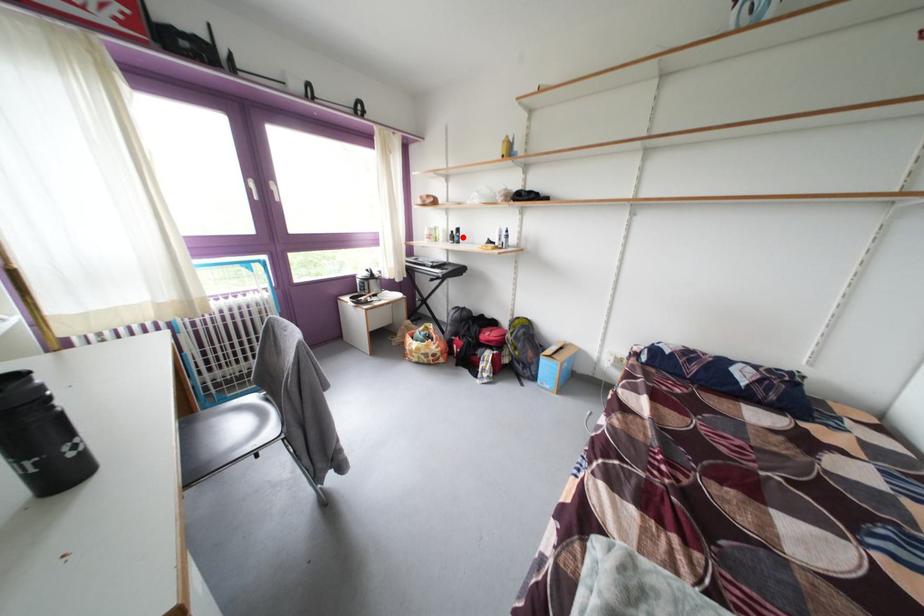
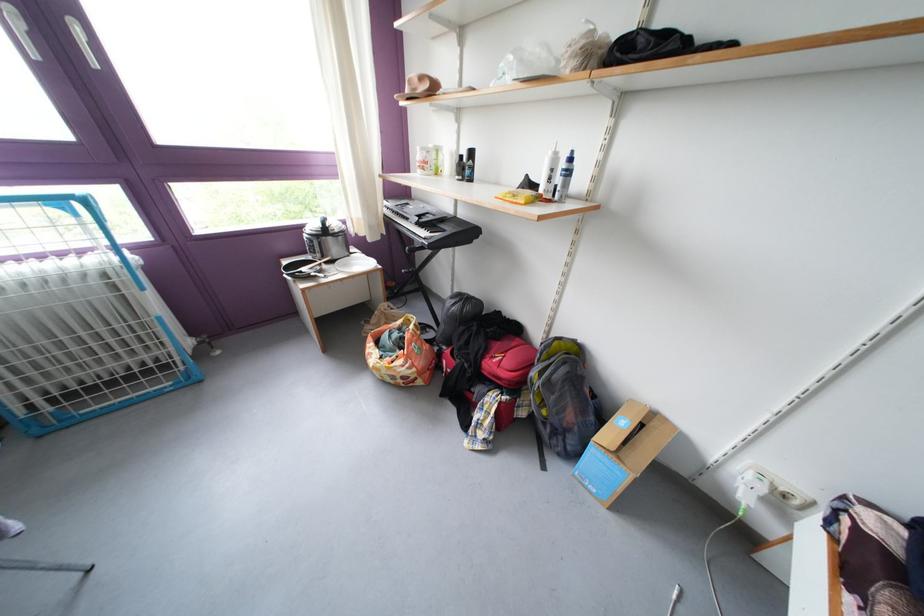
Locate, in the second image, the point that corresponds to the highlighted location in the first image.

(471, 161)